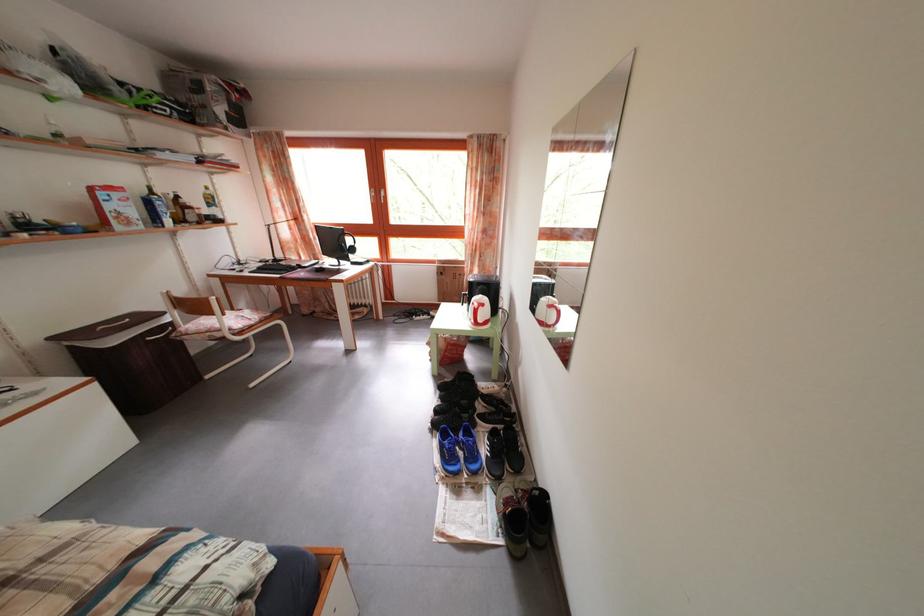
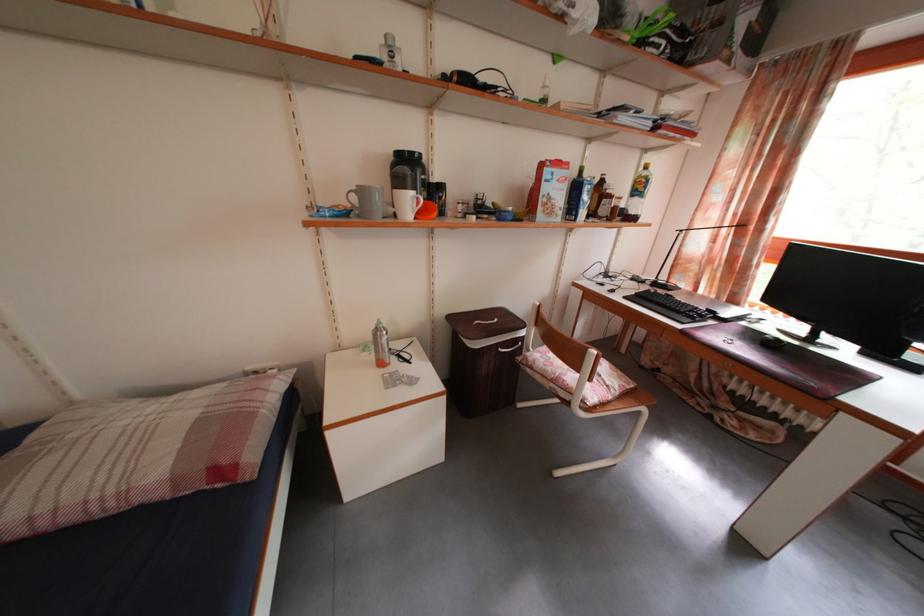
The point at (213,184) is marked in the first image. Where is the corresponding point in the second image?

(643, 161)